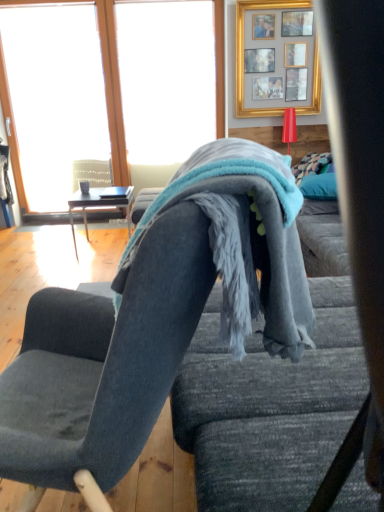
Measure the distance between point (130, 459) and camera.

Point (130, 459) is 1.08 meters from camera.

Describe the element at coordinates (319, 186) in the screenshot. I see `teal plush pillow at right` at that location.

What is the approximate width of transparent glass window at upper left?

The width of transparent glass window at upper left is 2.43 inches.

Where is `velvet dark gray chair at center`? velvet dark gray chair at center is located at coordinates (117, 356).

Find the location of `chair that appears below the transparent glass window at upper left (from a real-world perspective)`. chair that appears below the transparent glass window at upper left (from a real-world perspective) is located at coordinates (117, 356).

Between transparent glass window at upper left and velvet dark gray chair at center, which one appears on the left side from the viewer's perspective?

transparent glass window at upper left.

From a real-world perspective, is transparent glass window at upper left above or below velvet dark gray chair at center?

In terms of real-world spatial position, transparent glass window at upper left is above velvet dark gray chair at center.

Which object is thinner, transparent glass window at upper left or velvet dark gray chair at center?

With smaller width is transparent glass window at upper left.

From the picture: Is gold/glass picture frame at upper center oriented away from transparent glass window at upper left?

No, gold/glass picture frame at upper center's orientation is not away from transparent glass window at upper left.

Is point (262, 1) behind point (4, 93)?

No, it is not.

From a real-world perspective, is gold/glass picture frame at upper center physically located above or below transparent glass window at upper left?

From a real-world perspective, gold/glass picture frame at upper center is physically above transparent glass window at upper left.

Looking at this image, from the image's perspective, is gold/glass picture frame at upper center located beneath transparent glass window at upper left?

Actually, gold/glass picture frame at upper center appears above transparent glass window at upper left in the image.

Can you tell me how much transparent glass window at upper left and teal plush pillow at right differ in facing direction?

The facing directions of transparent glass window at upper left and teal plush pillow at right are 17.1 degrees apart.

Which object is closer to the camera taking this photo, transparent glass window at upper left or teal plush pillow at right?

Positioned in front is teal plush pillow at right.

From a real-world perspective, is transparent glass window at upper left positioned above or below teal plush pillow at right?

From a real-world perspective, transparent glass window at upper left is physically above teal plush pillow at right.

Would you say transparent glass window at upper left contains teal plush pillow at right?

No, transparent glass window at upper left does not contain teal plush pillow at right.

Considering the points (234, 234) and (107, 42), which point is in front, point (234, 234) or point (107, 42)?

The point (234, 234) is more forward.

Can you confirm if soft blue fleece blanket at center is wider than transparent glass window at upper left?

Indeed, soft blue fleece blanket at center has a greater width compared to transparent glass window at upper left.

Would you say soft blue fleece blanket at center is a long distance from transparent glass window at upper left?

Yes, soft blue fleece blanket at center and transparent glass window at upper left are located far from each other.

Does soft blue fleece blanket at center lie behind transparent glass window at upper left?

No, it is not.

How much distance is there between soft blue fleece blanket at center and transparent glass window at upper left?

The distance of soft blue fleece blanket at center from transparent glass window at upper left is 3.70 meters.

What's the angular difference between soft blue fleece blanket at center and transparent glass window at upper left's facing directions?

97.5 degrees separate the facing orientations of soft blue fleece blanket at center and transparent glass window at upper left.

Does point (150, 216) appear closer or farther from the camera than point (144, 13)?

Point (150, 216).

Considering the sizes of objects soft blue fleece blanket at center and transparent glass window at upper left in the image provided, who is smaller, soft blue fleece blanket at center or transparent glass window at upper left?

soft blue fleece blanket at center.

Considering the sizes of objects transparent glass window at upper left and teal plush pillow at right in the image provided, who is shorter, transparent glass window at upper left or teal plush pillow at right?

teal plush pillow at right.

Can we say transparent glass window at upper left lies outside teal plush pillow at right?

That's correct, transparent glass window at upper left is outside of teal plush pillow at right.

Between transparent glass window at upper left and teal plush pillow at right, which one appears on the left side from the viewer's perspective?

transparent glass window at upper left.

Is transparent glass window at upper left in front of or behind teal plush pillow at right in the image?

Visually, transparent glass window at upper left is located behind teal plush pillow at right.

Is wooden glossy table at left at the left side of soft blue fleece blanket at center?

Correct, you'll find wooden glossy table at left to the left of soft blue fleece blanket at center.

Is the surface of wooden glossy table at left in direct contact with soft blue fleece blanket at center?

Result: wooden glossy table at left is not next to soft blue fleece blanket at center, and they're not touching.

Between wooden glossy table at left and soft blue fleece blanket at center, which one has more height?

With more height is soft blue fleece blanket at center.

You are a GUI agent. You are given a task and a screenshot of the screen. Output one action in this format:
    pyautogui.click(x=<x>, y=<y>)
    Task: Click on the window above the velvet dark gray chair at center (from a real-world perspective)
    
    Given the screenshot: What is the action you would take?
    pyautogui.click(x=104, y=78)

You are a GUI agent. You are given a task and a screenshot of the screen. Output one action in this format:
    pyautogui.click(x=<x>, y=<y>)
    Task: Click on the picture frame in front of the transparent glass window at upper left
    
    Given the screenshot: What is the action you would take?
    pyautogui.click(x=259, y=46)

From the image, which object appears to be nearer to transparent glass window at upper left, wooden glossy table at left or velvet dark gray chair at center?

The object closer to transparent glass window at upper left is wooden glossy table at left.

Which object lies further to the anchor point gold/glass picture frame at upper center, soft blue fleece blanket at center or wooden glossy table at left?

soft blue fleece blanket at center is further to gold/glass picture frame at upper center.

Estimate the real-world distances between objects in this image. Which object is closer to transparent glass window at upper left, wooden glossy table at left or teal plush pillow at right?

Based on the image, wooden glossy table at left appears to be nearer to transparent glass window at upper left.

Considering their positions, is wooden glossy table at left positioned closer to velvet dark gray chair at center than teal plush pillow at right?

The object closer to velvet dark gray chair at center is wooden glossy table at left.

Estimate the real-world distances between objects in this image. Which object is further from teal plush pillow at right, soft blue fleece blanket at center or velvet dark gray chair at center?

velvet dark gray chair at center.

Estimate the real-world distances between objects in this image. Which object is further from gold/glass picture frame at upper center, transparent glass window at upper left or teal plush pillow at right?

teal plush pillow at right is further to gold/glass picture frame at upper center.

Considering their positions, is soft blue fleece blanket at center positioned closer to wooden glossy table at left than transparent glass window at upper left?

Based on the image, transparent glass window at upper left appears to be nearer to wooden glossy table at left.

From the image, which object appears to be farther from velvet dark gray chair at center, soft blue fleece blanket at center or wooden glossy table at left?

The object further to velvet dark gray chair at center is wooden glossy table at left.

Find the location of a particular element. The width and height of the screenshot is (384, 512). window between transparent glass window at upper left and wooden glossy table at left in the up-down direction is located at coordinates (104, 78).

Find the location of `blanket between velvet dark gray chair at center and wooden glossy table at left from front to back`. blanket between velvet dark gray chair at center and wooden glossy table at left from front to back is located at coordinates (243, 240).

This screenshot has width=384, height=512. Find the location of `blanket between velvet dark gray chair at center and teal plush pillow at right in the front-back direction`. blanket between velvet dark gray chair at center and teal plush pillow at right in the front-back direction is located at coordinates (243, 240).

Image resolution: width=384 pixels, height=512 pixels. Find the location of `table located between transparent glass window at upper left and teal plush pillow at right in the left-right direction`. table located between transparent glass window at upper left and teal plush pillow at right in the left-right direction is located at coordinates pyautogui.click(x=99, y=205).